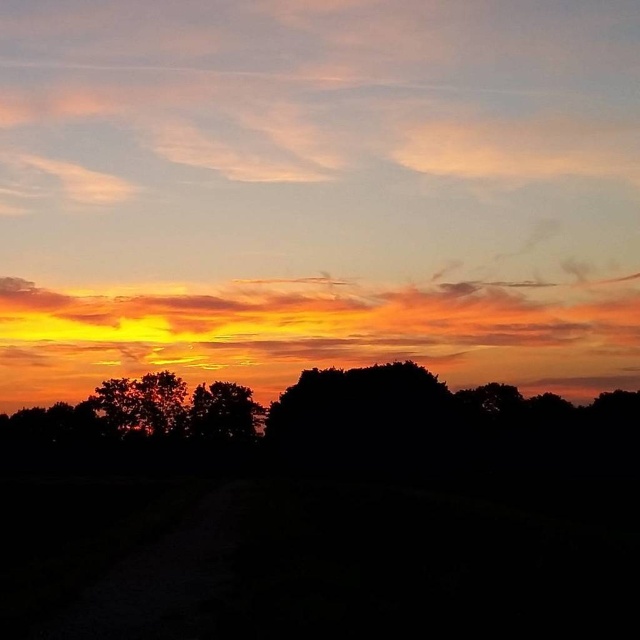
You are an artist trying to capture this sunset scene. You notice the orange translucent cloud at upper center and the silhouette tree at center. Which object is positioned to the right side of the other?

The orange translucent cloud at upper center is to the right of the silhouette tree at center.

You are a photographer trying to capture the sunset. You notice the orange translucent cloud at upper center and the silhouette tree at center. Which object would appear larger in your photo?

The orange translucent cloud at upper center would appear larger in the photo because it is bigger than the silhouette tree at center according to the description.